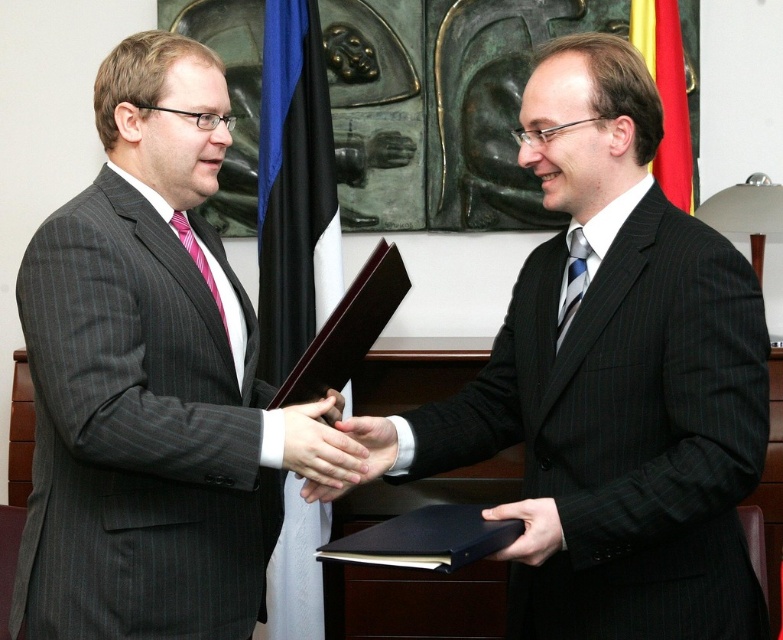
Based on the photo, you are a photographer setting up for a formal event. You need to position a camera so that both the black pinstripe suit at center and the black leather folder at lower center are in frame. Which object should you focus on first to ensure both are in focus?

The black pinstripe suit at center is above the black leather folder at lower center, so you should focus on the black pinstripe suit at center first to ensure both are in focus.

You are a photographer standing at a distance of 5 feet from the scene. You want to take a closeup shot of the smooth skin hands at center without including any background elements. Is the current distance sufficient?

The smooth skin hands at center is 4.84 feet from viewer. Since you are standing at 5 feet away, you can adjust your camera to zoom in and capture the hands without including the background elements.

You are a photographer at the event and need to place a small name tag on the black leather folder at lower center without covering the smooth skin hand at center. Is the folder large enough to accommodate the name tag?

The black leather folder at lower center is smaller than the smooth skin hand at center. Since the hand is larger, the folder might not have enough space for the name tag without overlapping the hand.